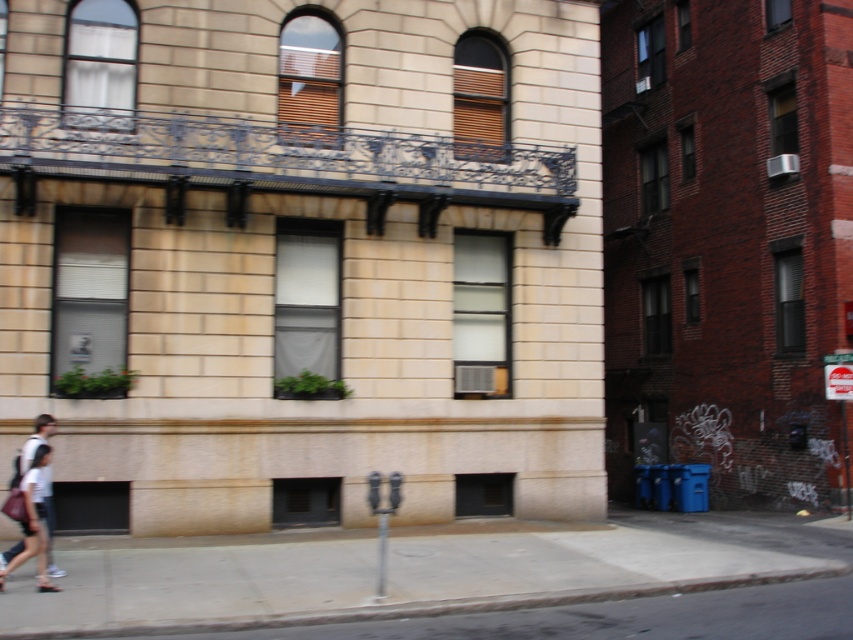
Which is more to the left, gray concrete sidewalk at lower center or white cotton shirt at lower left?

Positioned to the left is white cotton shirt at lower left.

Does gray concrete sidewalk at lower center appear on the right side of white cotton shirt at lower left?

Correct, you'll find gray concrete sidewalk at lower center to the right of white cotton shirt at lower left.

Who is more distant from viewer, [20,582] or [13,556]?

The point [20,582] is more distant.

The width and height of the screenshot is (853, 640). In order to click on gray concrete sidewalk at lower center in this screenshot , I will do `click(460, 580)`.